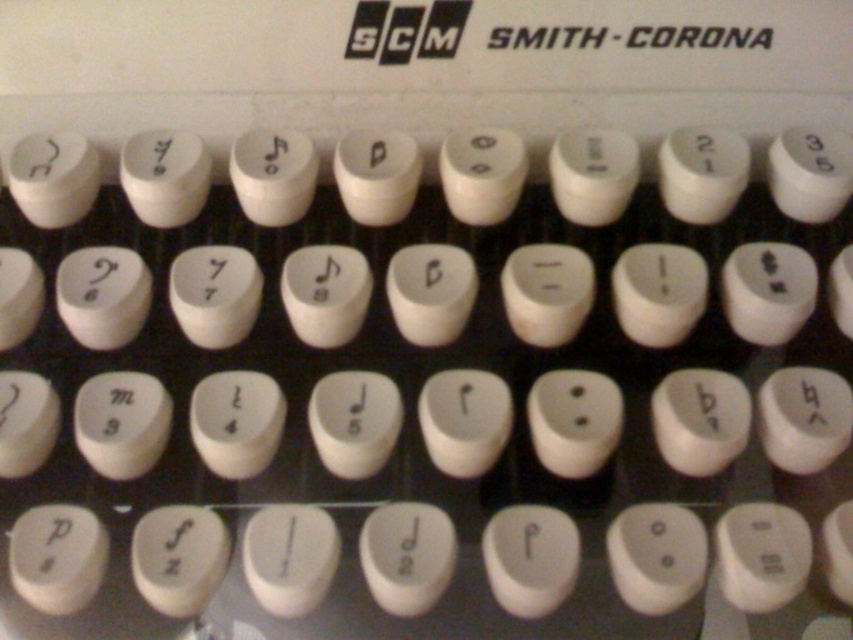
Question: Among these points, which one is nearest to the camera?

Choices:
 (A) [x=155, y=152]
 (B) [x=685, y=44]

Answer: (A)

Question: Which of the following is the farthest from the observer?

Choices:
 (A) (653, 48)
 (B) (33, 179)

Answer: (A)

Question: Does black plastic text at upper center lie behind matte white key at upper left?

Choices:
 (A) no
 (B) yes

Answer: (B)

Question: Where is matte white key at upper left located in relation to white plastic key at center in the image?

Choices:
 (A) below
 (B) above

Answer: (A)

Question: Is black plastic text at upper center thinner than matte white key at upper left?

Choices:
 (A) no
 (B) yes

Answer: (A)

Question: Which is farther from the black plastic text at upper center?

Choices:
 (A) white plastic key at center
 (B) matte white key at upper left

Answer: (B)